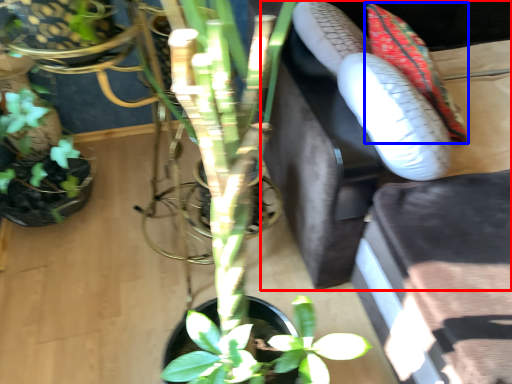
Question: Which object appears closest to the camera in this image, couch (highlighted by a red box) or flower (highlighted by a blue box)?

Choices:
 (A) couch
 (B) flower

Answer: (A)